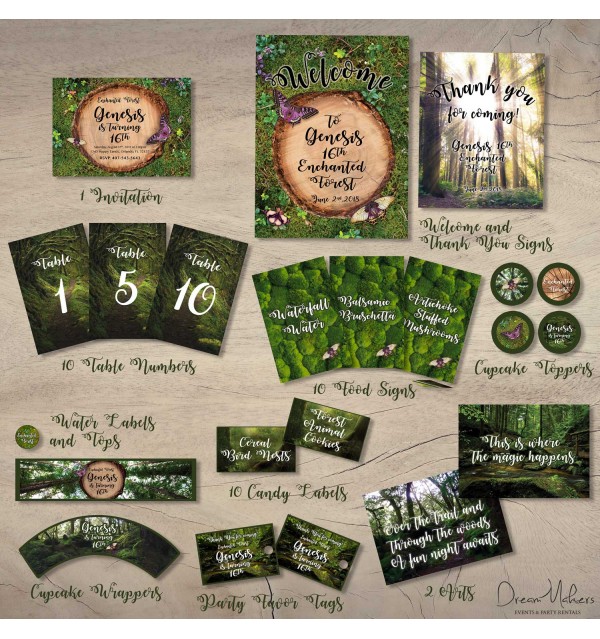
Locate an element on the screen. This screenshot has height=639, width=600. wooden table background is located at coordinates (276, 390).